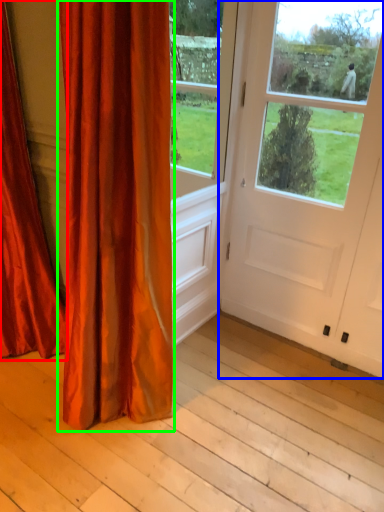
Question: Which object is the closest to the curtain (highlighted by a red box)? Choose among these: door (highlighted by a blue box) or curtain (highlighted by a green box).

Choices:
 (A) door
 (B) curtain

Answer: (B)